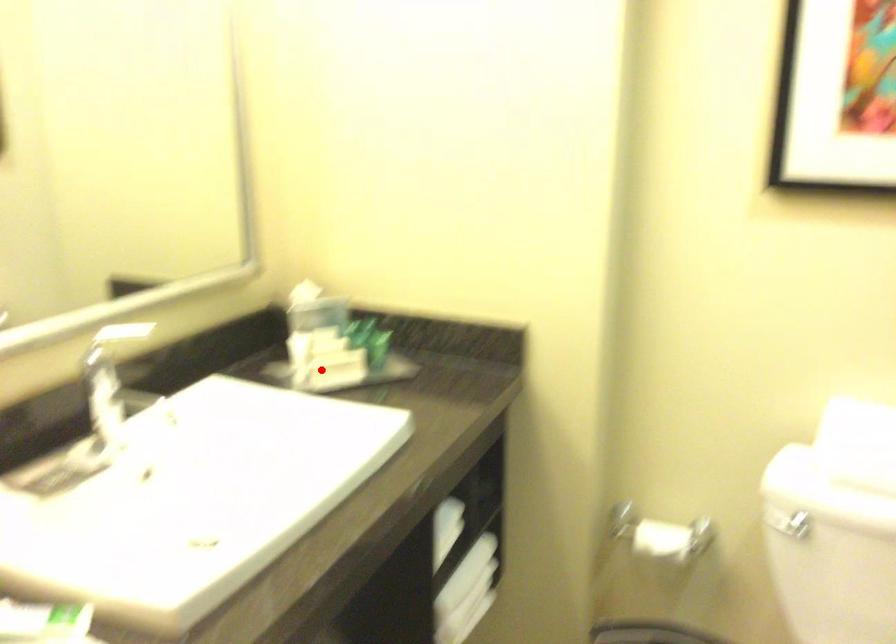
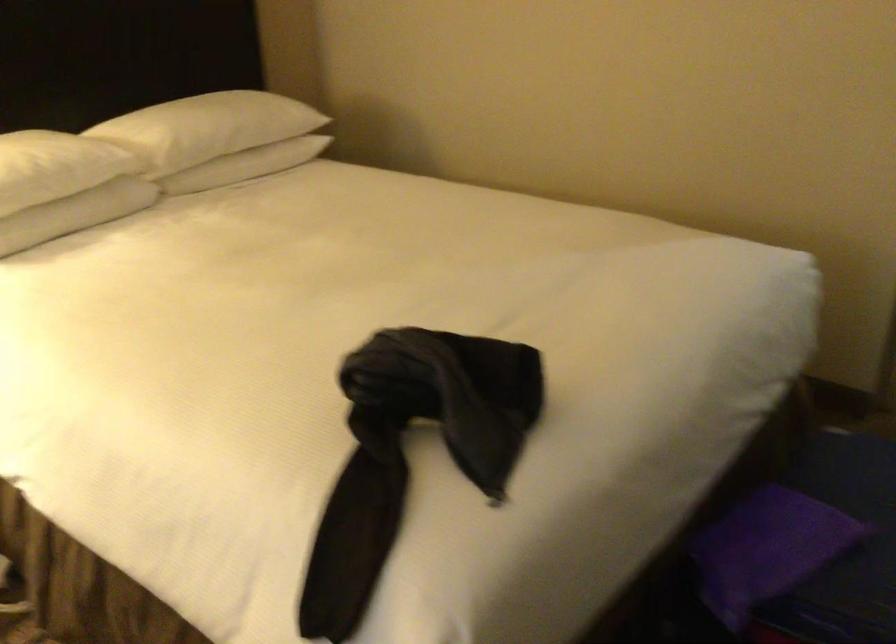
Question: I am providing you with two images of the same scene from different viewpoints. A red point is marked on the first image. At the location where the point appears in image 1, is it still visible in image 2?

Choices:
 (A) Yes
 (B) No

Answer: (B)